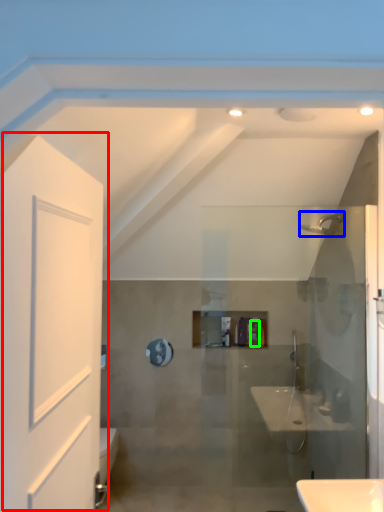
Question: Estimate the real-world distances between objects in this image. Which object is closer to door (highlighted by a red box), shower (highlighted by a blue box) or toiletry (highlighted by a green box)?

Choices:
 (A) shower
 (B) toiletry

Answer: (A)